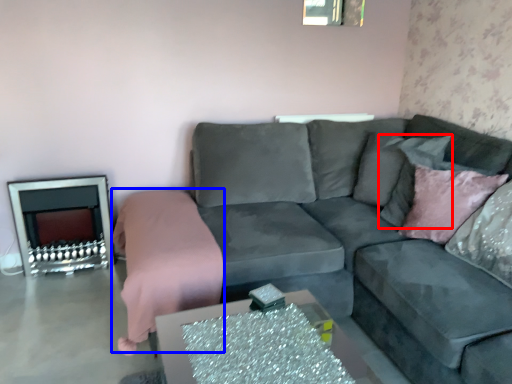
Question: Which point is further to the camera, pillow (highlighted by a red box) or bedding (highlighted by a blue box)?

Choices:
 (A) pillow
 (B) bedding

Answer: (A)